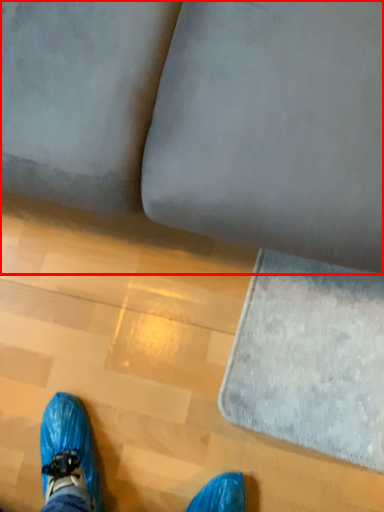
Question: From the image, what is the correct spatial relationship of studio couch (annotated by the red box) in relation to mat?

Choices:
 (A) right
 (B) left

Answer: (B)